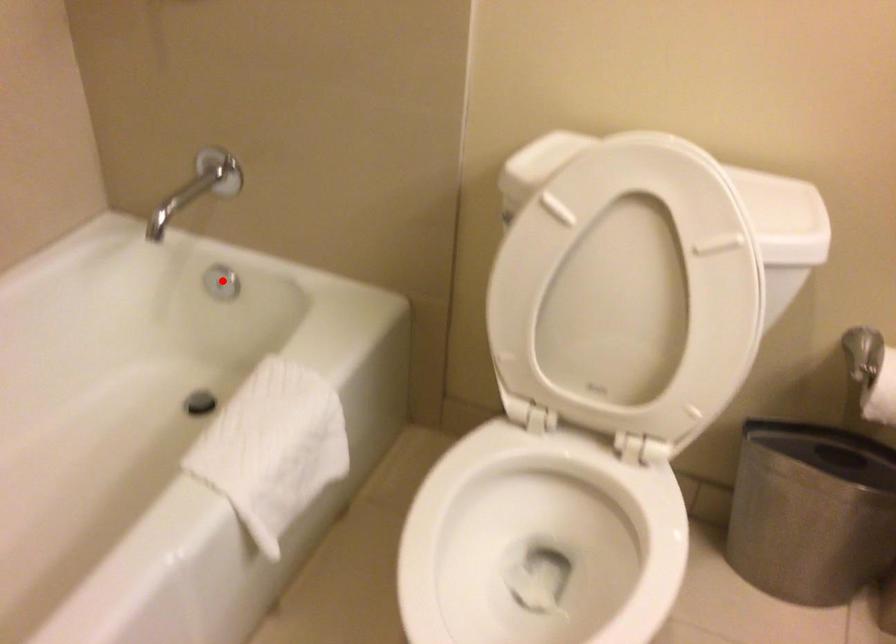
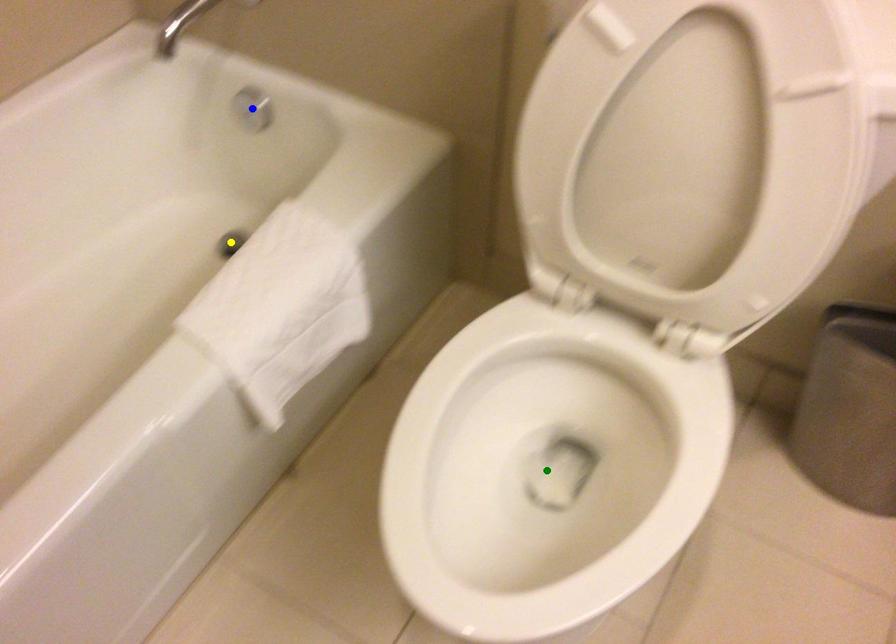
Question: I am providing you with two images of the same scene from different viewpoints. A red point is marked on the first image. You are given multiple points on the second image. Which point in image 2 represents the same 3d spot as the red point in image 1?

Choices:
 (A) yellow point
 (B) blue point
 (C) green point

Answer: (B)